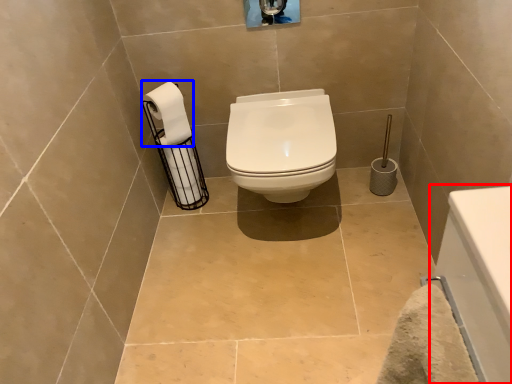
Question: Which object is closer to the camera taking this photo, bath (highlighted by a red box) or toilet paper (highlighted by a blue box)?

Choices:
 (A) bath
 (B) toilet paper

Answer: (A)